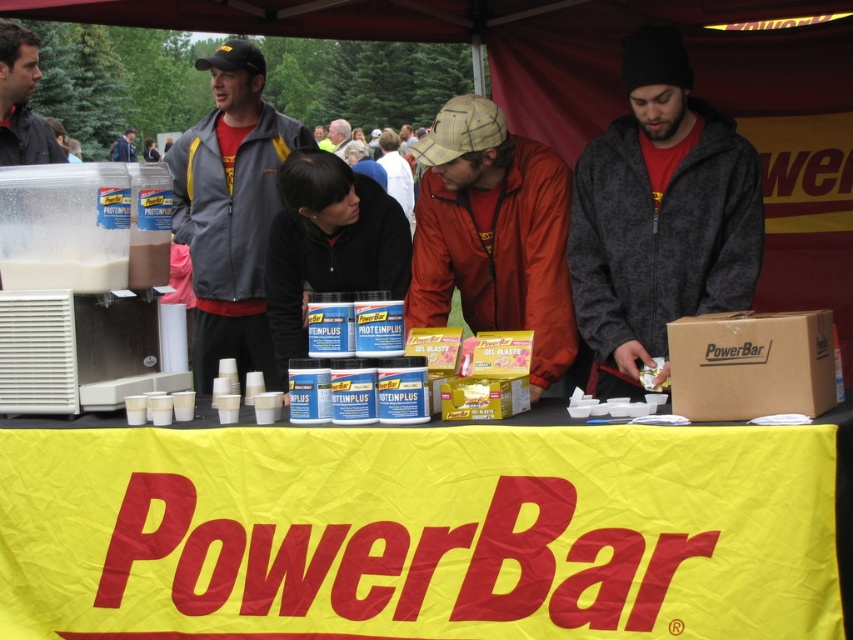
You are organizing an event and need to ensure that the yellow fabric banner at center is visible to all attendees. Given that the matte black jacket at center is currently blocking part of the banner, what should you do?

The yellow fabric banner at center is in front of the matte black jacket at center, so it is already positioned to be visible over the jacket. No adjustment is needed unless the jacket wearer moves closer or the banner is not fully visible.

You are organizing a sports event and need to determine which volunteer jackets can accommodate a large patch. The volunteer jackets available are the red jacket at center and the dark gray jacket at upper left. Based on the image, which jacket has a larger width and is more suitable for the patch?

The red jacket at center has a larger width than the dark gray jacket at upper left, making it more suitable for the large patch.